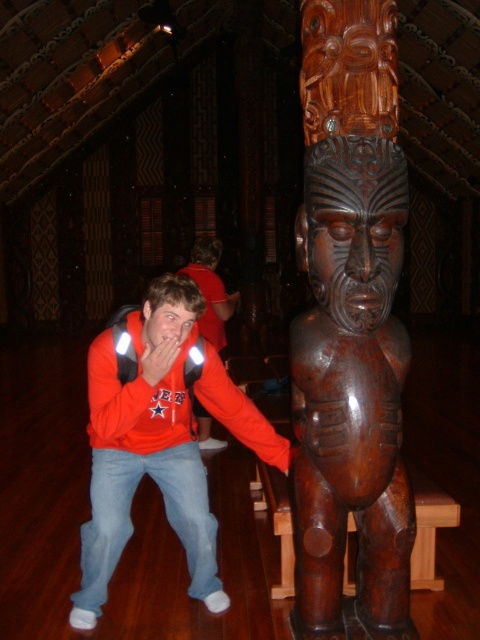
Question: Is brown polished wood statue at center wider than matte red hoodie at center?

Choices:
 (A) yes
 (B) no

Answer: (B)

Question: In this image, where is brown polished wood statue at center located relative to orange fleece jacket at center?

Choices:
 (A) right
 (B) left

Answer: (A)

Question: Which is farther from the brown polished wood statue at center?

Choices:
 (A) orange fleece jacket at center
 (B) matte red hoodie at center

Answer: (B)

Question: Does brown polished wood statue at center appear under orange fleece jacket at center?

Choices:
 (A) no
 (B) yes

Answer: (A)

Question: Which of these objects is positioned closest to the brown polished wood statue at center?

Choices:
 (A) matte red hoodie at center
 (B) orange fleece jacket at center

Answer: (B)

Question: Which point is closer to the camera?

Choices:
 (A) pyautogui.click(x=348, y=211)
 (B) pyautogui.click(x=192, y=272)
 (C) pyautogui.click(x=115, y=557)

Answer: (A)